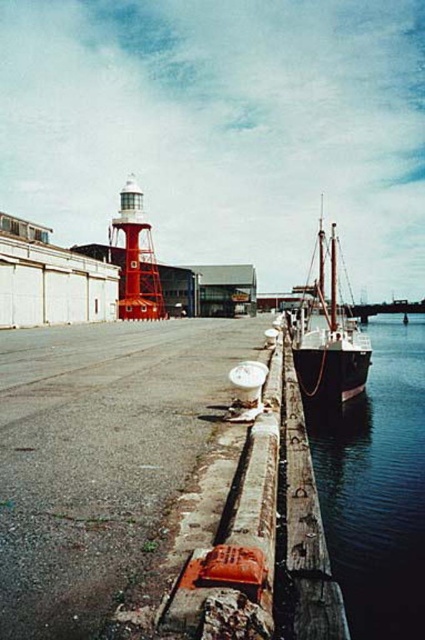
Who is positioned more to the right, dark blue water at lower right or wooden ship at right?

Positioned to the right is wooden ship at right.

Does dark blue water at lower right appear on the right side of wooden ship at right?

No, dark blue water at lower right is not to the right of wooden ship at right.

Locate an element on the screen. This screenshot has width=425, height=640. dark blue water at lower right is located at coordinates (377, 486).